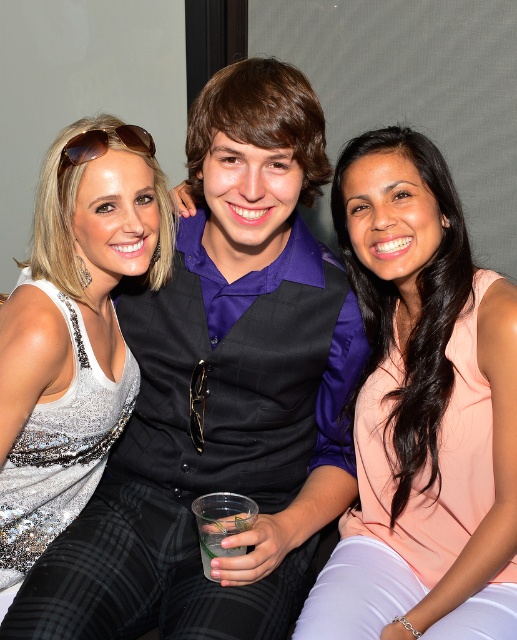
Question: Which of these objects is positioned farthest from the satin silver dress at center?

Choices:
 (A) peach satin blouse at center
 (B) matte black vest at center

Answer: (A)

Question: Is peach satin blouse at center wider than satin silver dress at center?

Choices:
 (A) yes
 (B) no

Answer: (A)

Question: Which of the following is the closest to the observer?

Choices:
 (A) matte black vest at center
 (B) peach satin blouse at center

Answer: (A)

Question: Is matte black vest at center bigger than peach satin blouse at center?

Choices:
 (A) no
 (B) yes

Answer: (B)

Question: Among these points, which one is nearest to the camera?

Choices:
 (A) (38, 314)
 (B) (242, 592)
 (C) (454, 627)

Answer: (C)

Question: Does peach satin blouse at center appear over satin silver dress at center?

Choices:
 (A) no
 (B) yes

Answer: (A)